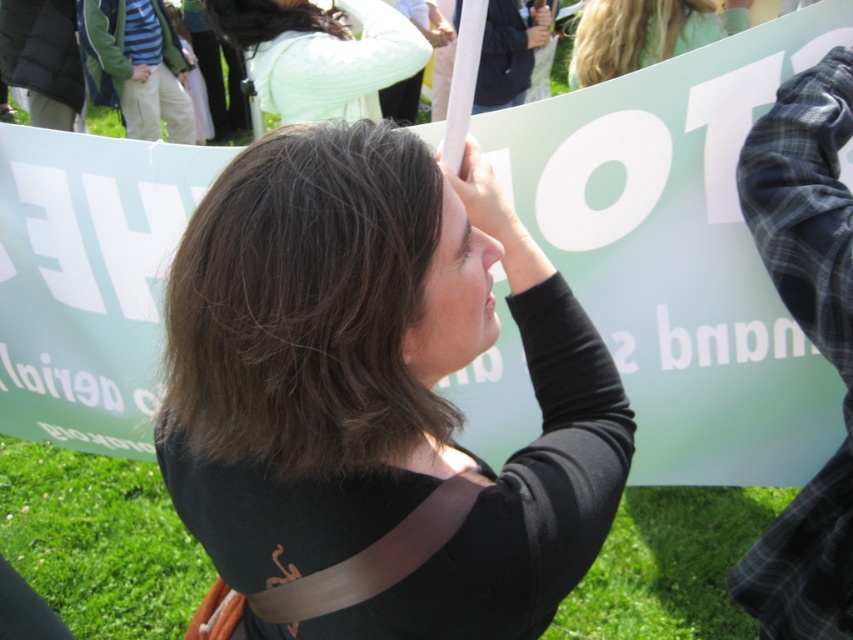
In the scene shown: Which of these two, black matte shirt at center or white knitted sweater at upper center, stands taller?

black matte shirt at center

Who is more forward, (169, 426) or (393, 35)?

Positioned in front is point (169, 426).

The width and height of the screenshot is (853, 640). Find the location of `black matte shirt at center`. black matte shirt at center is located at coordinates (376, 396).

Is white knitted sweater at upper center positioned before blonde hair at upper center?

Yes, it is.

From the picture: Between white knitted sweater at upper center and blonde hair at upper center, which one has less height?

blonde hair at upper center

Which is in front, point (309, 20) or point (703, 44)?

Point (703, 44)

Where is `white knitted sweater at upper center`? white knitted sweater at upper center is located at coordinates (320, 54).

Locate an element on the screen. The width and height of the screenshot is (853, 640). black matte shirt at center is located at coordinates (376, 396).